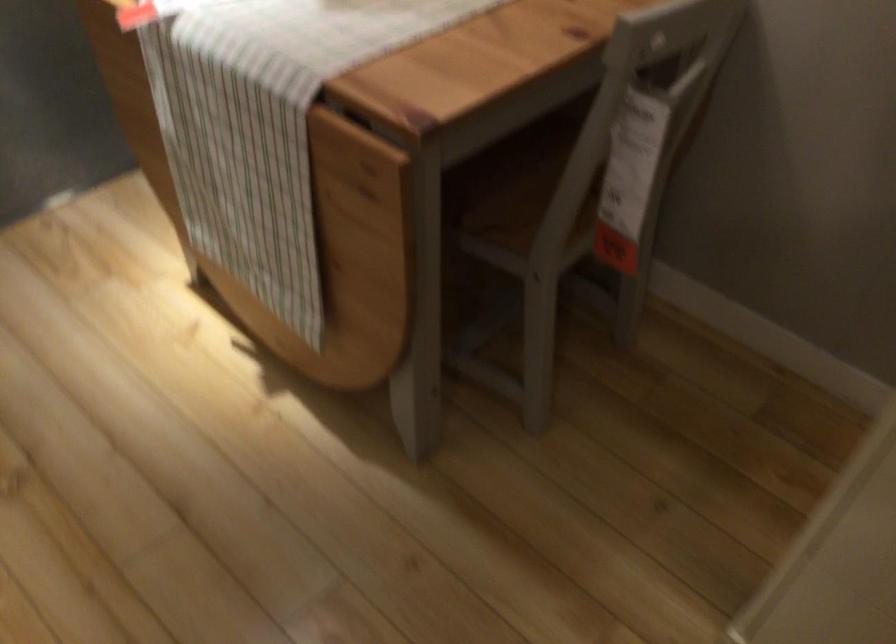
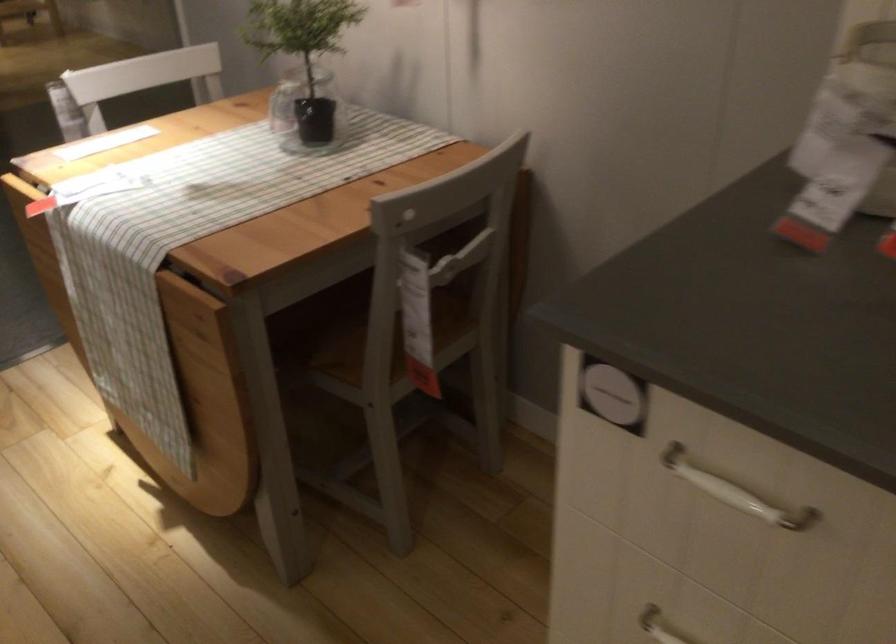
Locate, in the second image, the point that corresponds to point (582, 213) in the first image.

(390, 350)